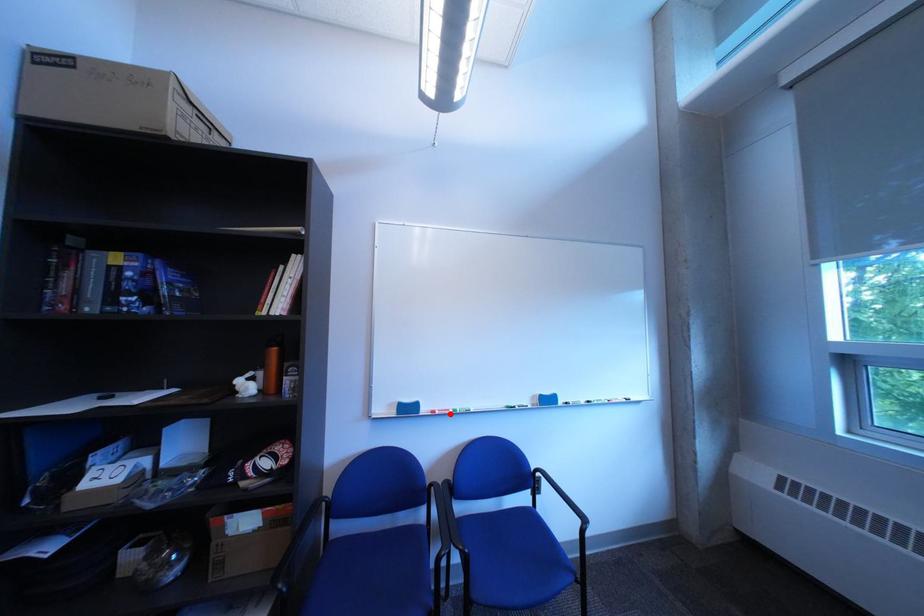
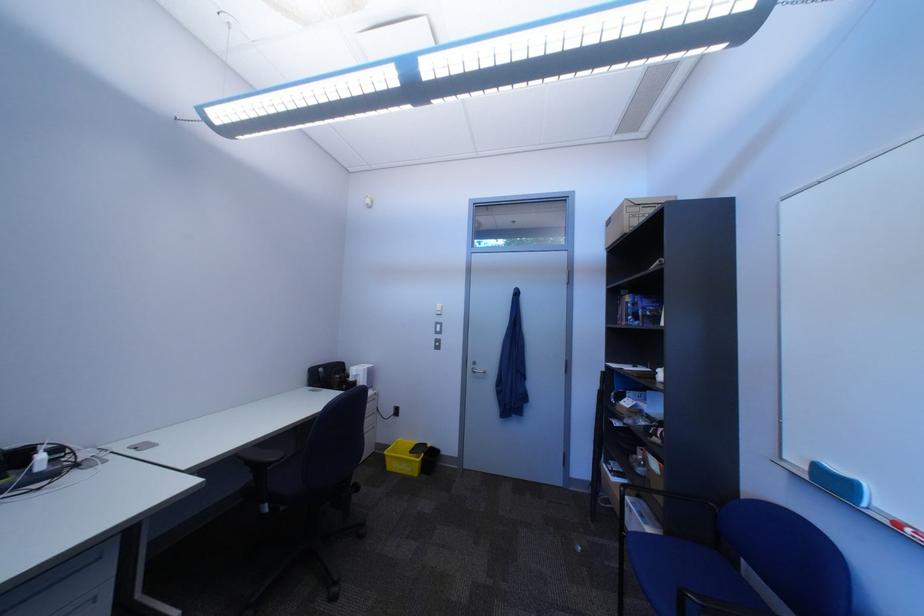
In the second image, find the point that corresponds to the highlighted location in the first image.

(915, 527)